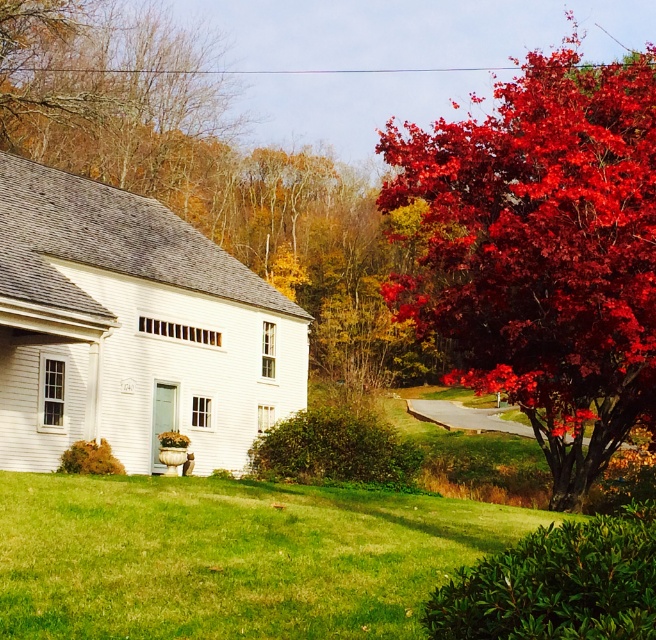
Is shiny crimson maple at right below green grass at lower center?

No.

Does shiny crimson maple at right appear on the left side of green grass at lower center?

In fact, shiny crimson maple at right is to the right of green grass at lower center.

Which is in front, point (525, 205) or point (195, 493)?

Positioned in front is point (195, 493).

Identify the location of shiny crimson maple at right. This screenshot has width=656, height=640. (543, 250).